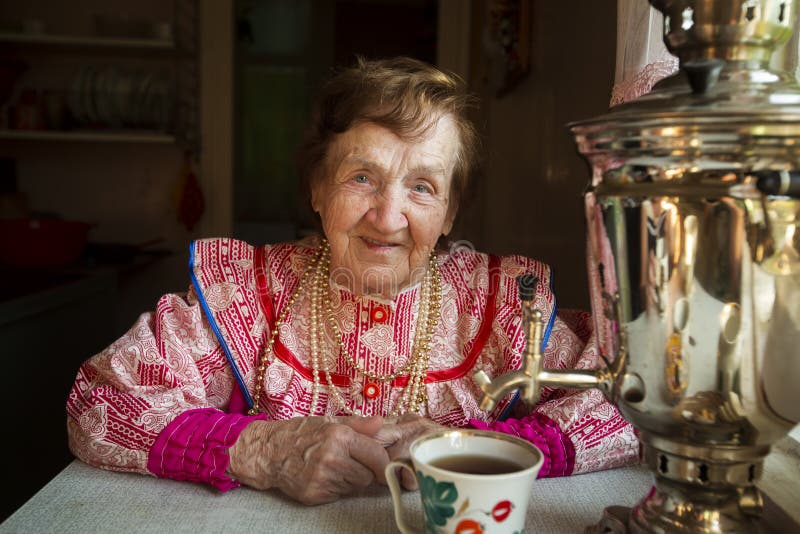
Find the location of `table top`. table top is located at coordinates (x=254, y=516).